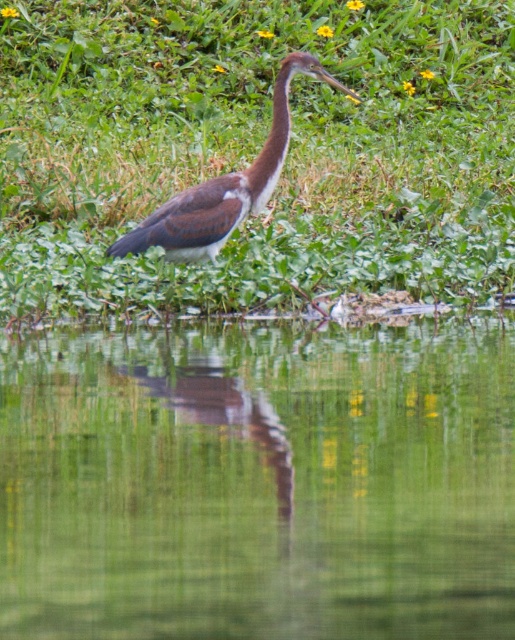
Between green leafy grass at center and brown matte bird at center, which one appears on the left side from the viewer's perspective?

brown matte bird at center

This screenshot has width=515, height=640. I want to click on green leafy grass at center, so click(255, 150).

Is green reflective water at center to the left of brown matte bird at center from the viewer's perspective?

Incorrect, green reflective water at center is not on the left side of brown matte bird at center.

Is green reflective water at center smaller than brown matte bird at center?

Incorrect, green reflective water at center is not smaller in size than brown matte bird at center.

Where is `green reflective water at center`? The width and height of the screenshot is (515, 640). green reflective water at center is located at coordinates (259, 481).

Is the position of brown matte bird at center more distant than that of brown matte neck at center?

Yes, brown matte bird at center is behind brown matte neck at center.

Which is behind, point (186, 237) or point (255, 195)?

The point (186, 237) is more distant.

Between point (214, 252) and point (285, 115), which one is positioned behind?

The point (214, 252) is more distant.

You are a GUI agent. You are given a task and a screenshot of the screen. Output one action in this format:
    pyautogui.click(x=<x>, y=<y>)
    Task: Click on the brown matte bird at center
    
    Given the screenshot: What is the action you would take?
    pyautogui.click(x=225, y=186)